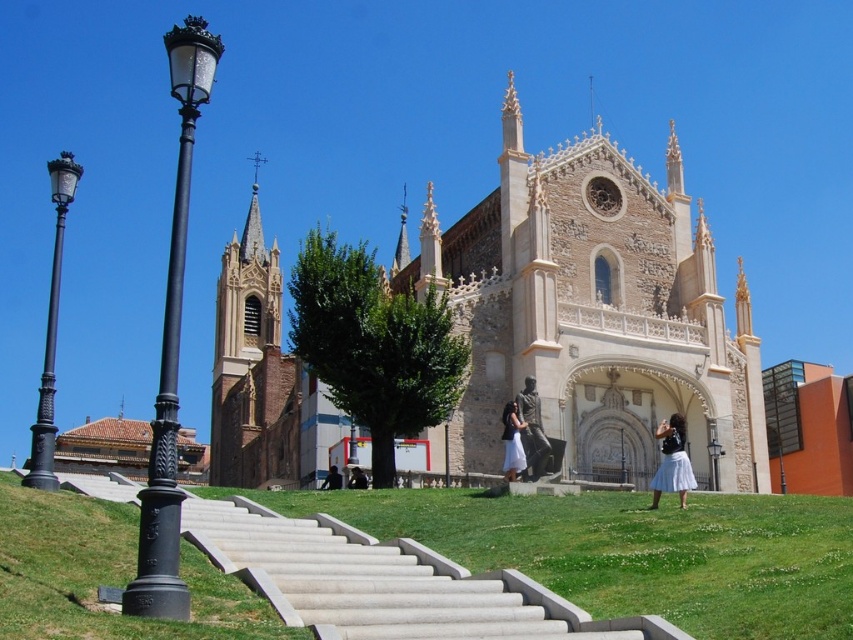
Question: Estimate the real-world distances between objects in this image. Which object is farther from the white cotton skirt at lower right?

Choices:
 (A) dark fabric bag at lower center
 (B) white cotton dress at center
 (C) beige stone church at center
 (D) smooth concrete stairs at center

Answer: (C)

Question: Does beige stone church at center lie behind dark brown leather jacket at center?

Choices:
 (A) no
 (B) yes

Answer: (A)

Question: Which object appears closest to the camera in this image?

Choices:
 (A) dark brown leather jacket at center
 (B) white cotton dress at center
 (C) dark fabric bag at lower center
 (D) smooth concrete stairs at center

Answer: (D)

Question: Based on their relative distances, which object is farther from the beige stone church at center?

Choices:
 (A) white cotton dress at center
 (B) dark fabric bag at lower center
 (C) white cotton skirt at lower right

Answer: (A)

Question: Considering the relative positions of smooth concrete stairs at center and dark brown leather jacket at center in the image provided, where is smooth concrete stairs at center located with respect to dark brown leather jacket at center?

Choices:
 (A) below
 (B) above

Answer: (B)

Question: Is smooth concrete stairs at center positioned before dark brown leather jacket at center?

Choices:
 (A) yes
 (B) no

Answer: (A)